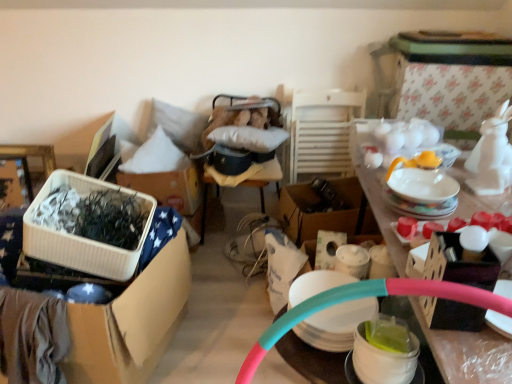
The image size is (512, 384). Identify the location of empty space that is ontop of translucent plastic cups at center. (332, 286).